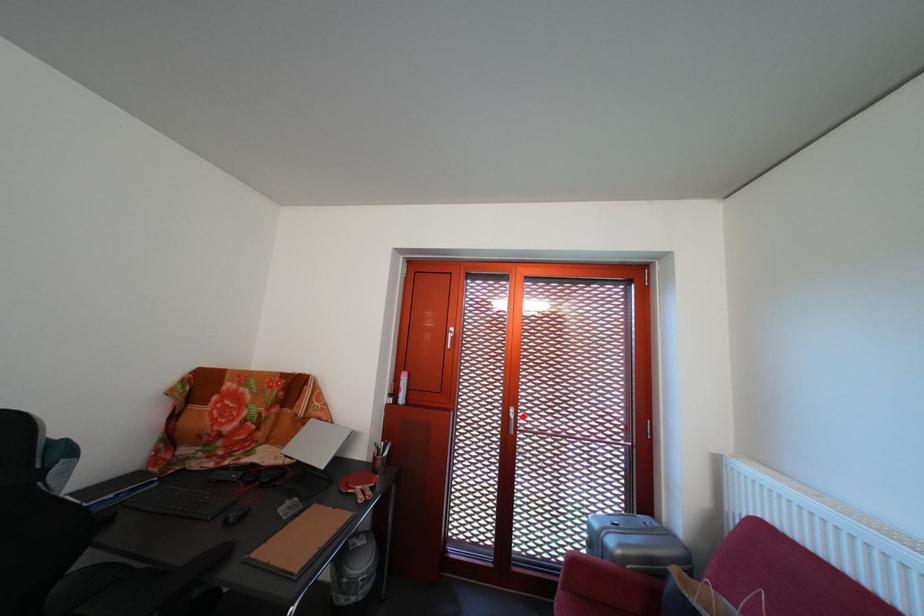
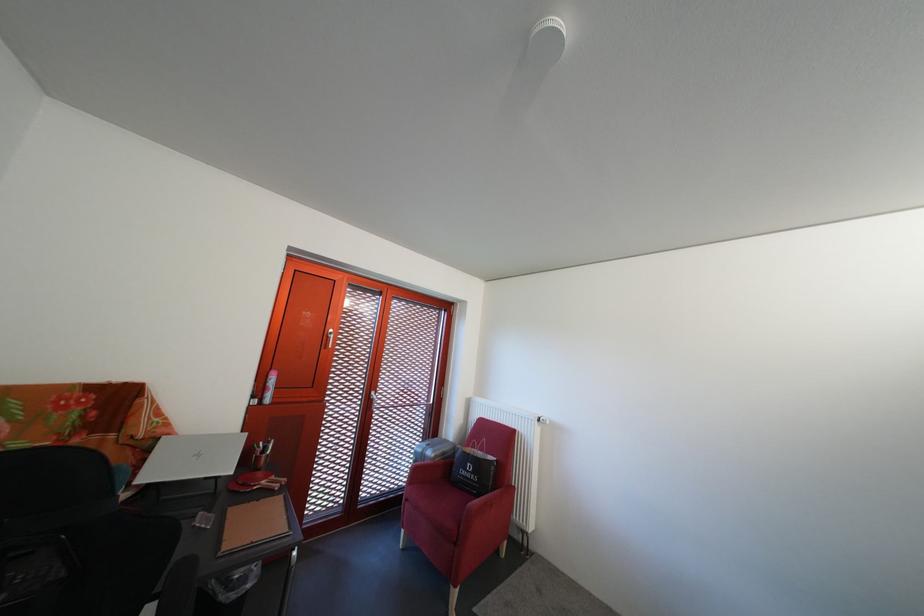
The point at the highlighted location is marked in the first image. Where is the corresponding point in the second image?

(383, 400)